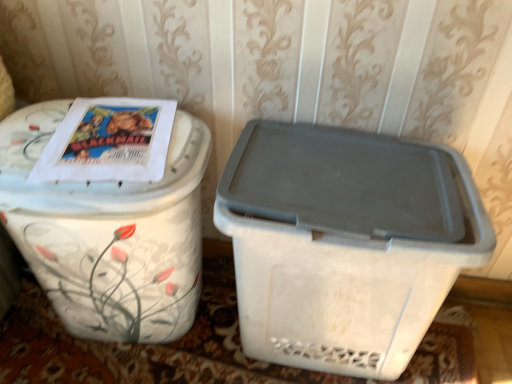
Question: Considering the relative positions of white glossy trash can at upper left, arranged as the 1th waste container when viewed from the left, and white plastic container at right, the second waste container from the left, in the image provided, is white glossy trash can at upper left, arranged as the 1th waste container when viewed from the left, to the left of white plastic container at right, the second waste container from the left, from the viewer's perspective?

Choices:
 (A) yes
 (B) no

Answer: (A)

Question: Considering the relative sizes of white glossy trash can at upper left, acting as the 2th waste container starting from the right, and white plastic container at right, the second waste container from the left, in the image provided, is white glossy trash can at upper left, acting as the 2th waste container starting from the right, thinner than white plastic container at right, the second waste container from the left,?

Choices:
 (A) no
 (B) yes

Answer: (A)

Question: Is white glossy trash can at upper left, arranged as the 1th waste container when viewed from the left, positioned with its back to white plastic container at right, which ranks as the first waste container in right-to-left order?

Choices:
 (A) yes
 (B) no

Answer: (B)

Question: Can you confirm if white glossy trash can at upper left, arranged as the 1th waste container when viewed from the left, is shorter than white plastic container at right, the second waste container from the left?

Choices:
 (A) no
 (B) yes

Answer: (A)

Question: From the image's perspective, does white glossy trash can at upper left, arranged as the 1th waste container when viewed from the left, appear higher than white plastic container at right, the second waste container from the left?

Choices:
 (A) yes
 (B) no

Answer: (A)

Question: Is the position of white glossy trash can at upper left, acting as the 2th waste container starting from the right, less distant than that of white plastic container at right, the second waste container from the left?

Choices:
 (A) yes
 (B) no

Answer: (A)

Question: Are white plastic container at right, the second waste container from the left, and white glossy trash can at upper left, arranged as the 1th waste container when viewed from the left, beside each other?

Choices:
 (A) no
 (B) yes

Answer: (A)

Question: From the image's perspective, is white plastic container at right, the second waste container from the left, over white glossy trash can at upper left, arranged as the 1th waste container when viewed from the left?

Choices:
 (A) no
 (B) yes

Answer: (A)

Question: Considering the relative positions of white plastic container at right, the second waste container from the left, and white glossy trash can at upper left, arranged as the 1th waste container when viewed from the left, in the image provided, is white plastic container at right, the second waste container from the left, to the right of white glossy trash can at upper left, arranged as the 1th waste container when viewed from the left, from the viewer's perspective?

Choices:
 (A) yes
 (B) no

Answer: (A)

Question: Considering the relative sizes of white plastic container at right, the second waste container from the left, and white glossy trash can at upper left, acting as the 2th waste container starting from the right, in the image provided, is white plastic container at right, the second waste container from the left, bigger than white glossy trash can at upper left, acting as the 2th waste container starting from the right,?

Choices:
 (A) no
 (B) yes

Answer: (A)

Question: Is white glossy trash can at upper left, arranged as the 1th waste container when viewed from the left, at the back of white plastic container at right, which ranks as the first waste container in right-to-left order?

Choices:
 (A) no
 (B) yes

Answer: (A)

Question: Is white plastic container at right, which ranks as the first waste container in right-to-left order, positioned behind white glossy trash can at upper left, arranged as the 1th waste container when viewed from the left?

Choices:
 (A) no
 (B) yes

Answer: (B)

Question: From their relative heights in the image, would you say white glossy trash can at upper left, acting as the 2th waste container starting from the right, is taller or shorter than white plastic container at right, the second waste container from the left?

Choices:
 (A) tall
 (B) short

Answer: (A)